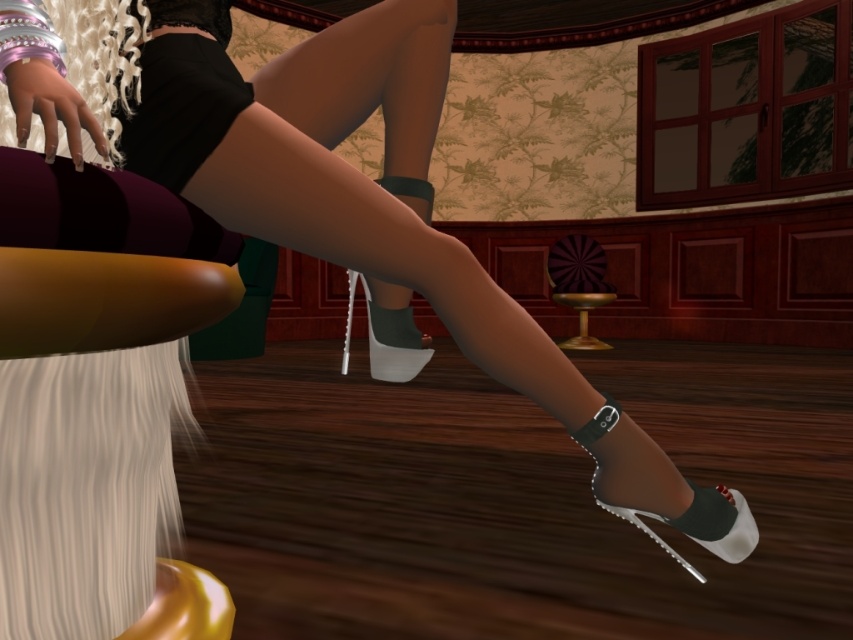
Who is positioned more to the right, black matte sock at lower right or dark green fabric sock at center?

black matte sock at lower right is more to the right.

Can you confirm if black matte sock at lower right is positioned to the right of dark green fabric sock at center?

Yes, black matte sock at lower right is to the right of dark green fabric sock at center.

Does point (718, 538) come farther from viewer compared to point (384, 310)?

That is False.

Identify the location of black matte sock at lower right. (706, 513).